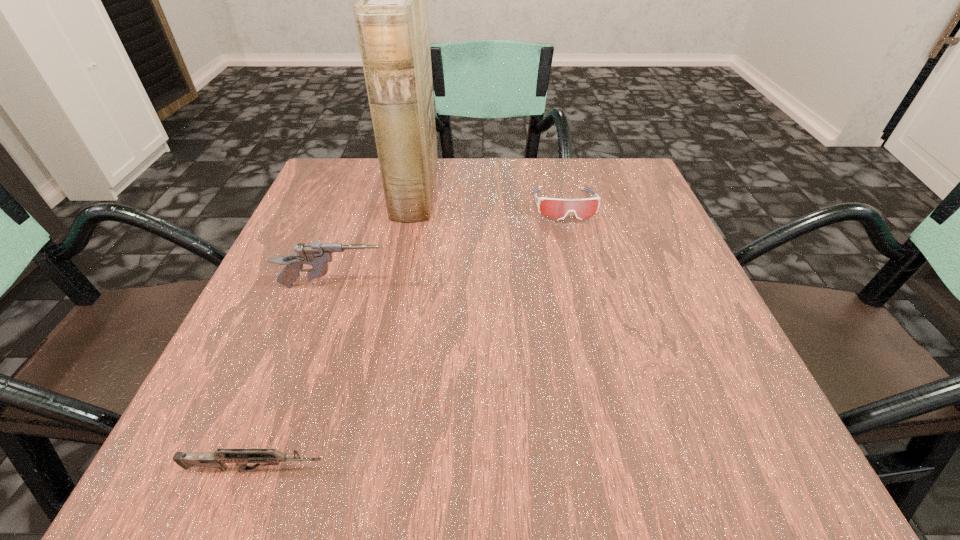
At what (x,y) coordinates should I click in order to perform the action: click on vacant area that lies between the second tallest object and the shorter gun. Please return your answer as a coordinate pair (x, y). This screenshot has height=540, width=960. Looking at the image, I should click on (295, 378).

Find the location of a particular element. The height and width of the screenshot is (540, 960). empty space between the rightmost object and the second nearest object is located at coordinates (449, 246).

The width and height of the screenshot is (960, 540). Find the location of `unoccupied position between the tallest object and the rightmost object`. unoccupied position between the tallest object and the rightmost object is located at coordinates (490, 198).

This screenshot has height=540, width=960. Identify the location of empty space that is in between the goggles and the third farthest object. (449, 246).

You are a GUI agent. You are given a task and a screenshot of the screen. Output one action in this format:
    pyautogui.click(x=<x>, y=<y>)
    Task: Click on the object that ranks as the third closest to the goggles
    This screenshot has width=960, height=540.
    Given the screenshot: What is the action you would take?
    pyautogui.click(x=217, y=460)

At what (x,y) coordinates should I click in order to perform the action: click on object that stands as the closest to the rightmost object. Please return your answer as a coordinate pair (x, y). The image size is (960, 540). Looking at the image, I should click on (x=391, y=18).

The image size is (960, 540). I want to click on blank space that satisfies the following two spatial constraints: 1. on the front-facing side of the rightmost object; 2. at the barrel of the third farthest object, so click(x=585, y=287).